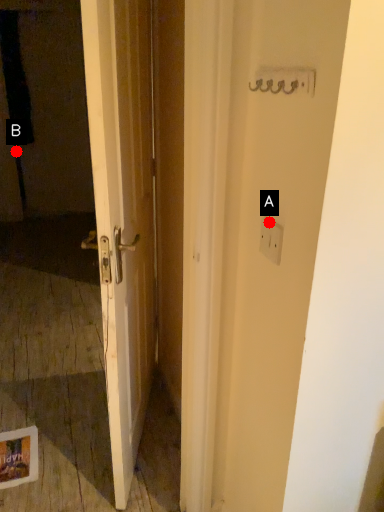
Question: Two points are circled on the image, labeled by A and B beside each circle. Which of the following is the farthest from the observer?

Choices:
 (A) A is further
 (B) B is further

Answer: (B)